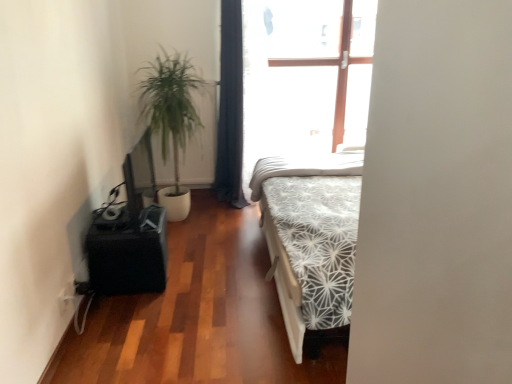
Question: Is dark blue fabric curtain at center bigger than green leafy plant at left?

Choices:
 (A) yes
 (B) no

Answer: (B)

Question: Is dark blue fabric curtain at center looking in the opposite direction of green leafy plant at left?

Choices:
 (A) no
 (B) yes

Answer: (A)

Question: Considering the relative sizes of dark blue fabric curtain at center and green leafy plant at left in the image provided, is dark blue fabric curtain at center smaller than green leafy plant at left?

Choices:
 (A) no
 (B) yes

Answer: (B)

Question: From a real-world perspective, is dark blue fabric curtain at center positioned over green leafy plant at left based on gravity?

Choices:
 (A) no
 (B) yes

Answer: (B)

Question: From the image's perspective, does dark blue fabric curtain at center appear higher than green leafy plant at left?

Choices:
 (A) yes
 (B) no

Answer: (A)

Question: From the image's perspective, is dark blue fabric curtain at center beneath green leafy plant at left?

Choices:
 (A) no
 (B) yes

Answer: (A)

Question: From a real-world perspective, is green leafy plant at left on top of white textured mattress at center?

Choices:
 (A) no
 (B) yes

Answer: (B)

Question: Considering the relative positions of green leafy plant at left and white textured mattress at center in the image provided, is green leafy plant at left in front of white textured mattress at center?

Choices:
 (A) no
 (B) yes

Answer: (B)

Question: From the image's perspective, is green leafy plant at left located beneath white textured mattress at center?

Choices:
 (A) no
 (B) yes

Answer: (A)

Question: From a real-world perspective, is green leafy plant at left physically below white textured mattress at center?

Choices:
 (A) no
 (B) yes

Answer: (A)

Question: From the image's perspective, is green leafy plant at left above white textured mattress at center?

Choices:
 (A) no
 (B) yes

Answer: (B)

Question: Does green leafy plant at left have a larger size compared to white textured mattress at center?

Choices:
 (A) yes
 (B) no

Answer: (A)

Question: Is black matte table at left facing towards white textured mattress at center?

Choices:
 (A) no
 (B) yes

Answer: (A)